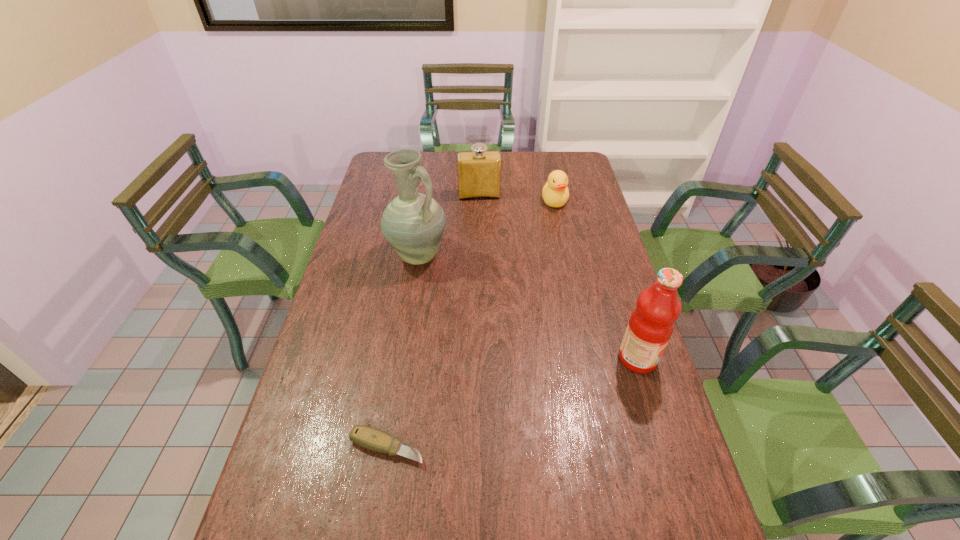
At what (x,y) coordinates should I click in order to perform the action: click on pocketknife. Please return your answer as a coordinate pair (x, y). Looking at the image, I should click on (370, 438).

This screenshot has width=960, height=540. Identify the location of the nearest object. (370, 438).

This screenshot has height=540, width=960. Find the location of `the rightmost object`. the rightmost object is located at coordinates (652, 322).

Identify the location of fruit juice. (652, 322).

This screenshot has height=540, width=960. Identify the location of perfume. (479, 171).

Find the location of a particular element. The height and width of the screenshot is (540, 960). the third shortest object is located at coordinates (479, 171).

Where is `duck`? This screenshot has width=960, height=540. duck is located at coordinates (555, 193).

You are a GUI agent. You are given a task and a screenshot of the screen. Output one action in this format:
    pyautogui.click(x=<x>, y=<y>)
    Task: Click on the second shortest object
    
    Given the screenshot: What is the action you would take?
    pyautogui.click(x=555, y=193)

At what (x,y) coordinates should I click in order to perform the action: click on pitcher. Please return your answer as a coordinate pair (x, y). This screenshot has width=960, height=540. Looking at the image, I should click on (413, 223).

You are a GUI agent. You are given a task and a screenshot of the screen. Output one action in this format:
    pyautogui.click(x=<x>, y=<y>)
    Task: Click on the third nearest object
    The height and width of the screenshot is (540, 960).
    Given the screenshot: What is the action you would take?
    pyautogui.click(x=413, y=223)